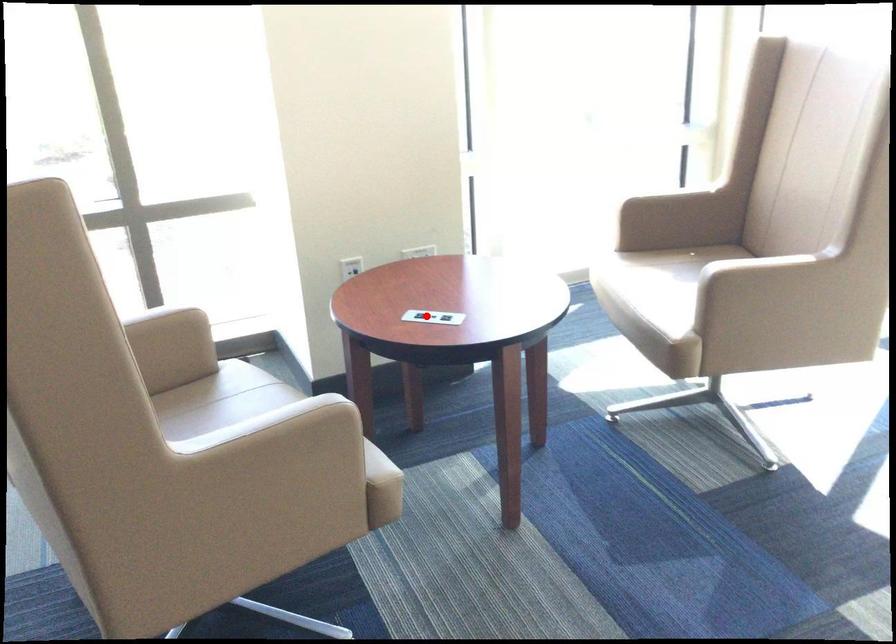
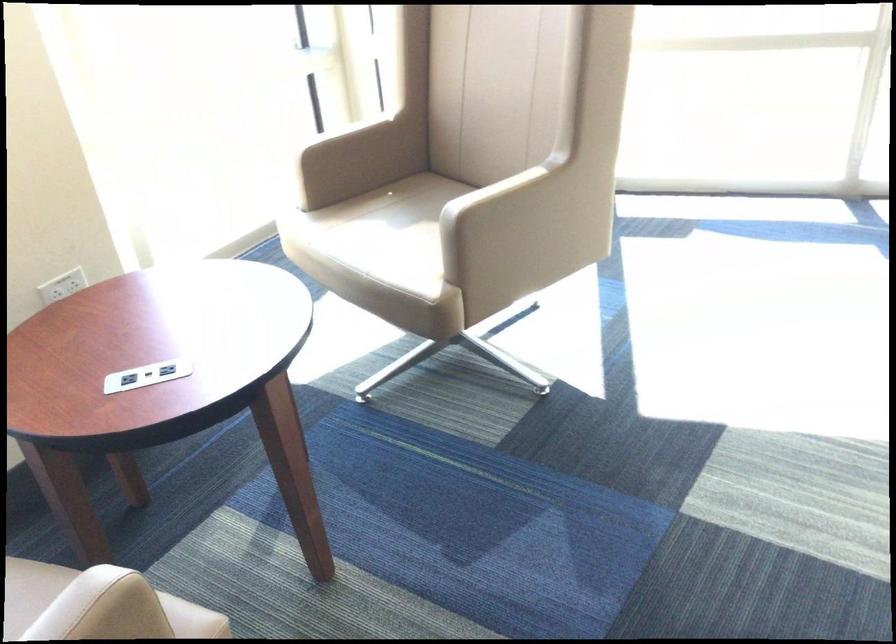
Question: I am providing you with two images of the same scene from different viewpoints. In image1, a red point is highlighted. Considering the same 3D point in image2, which of the following is correct?

Choices:
 (A) It is closer
 (B) It is farther

Answer: (A)